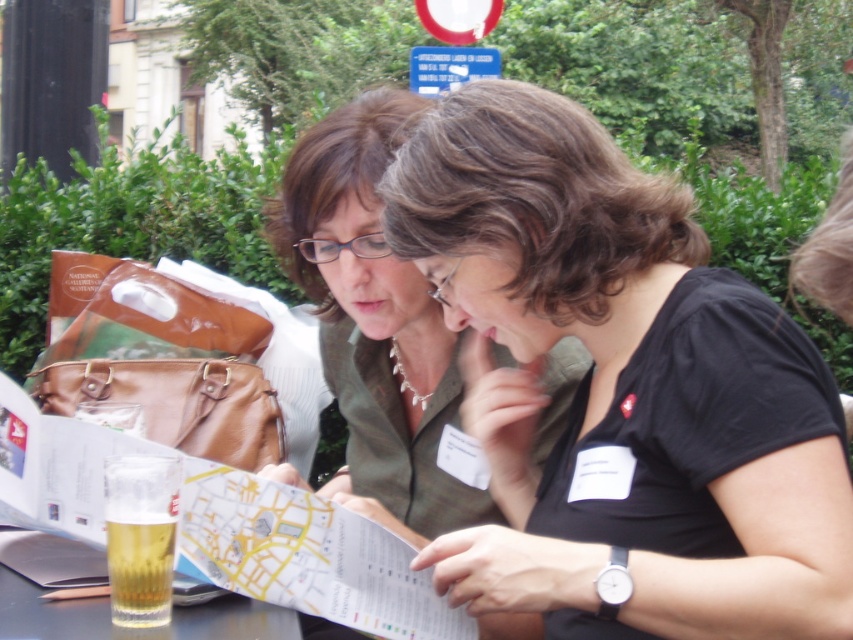
Describe the element at coordinates (619, 388) in the screenshot. The image size is (853, 640). I see `black matte shirt at center` at that location.

Who is more forward, (x=483, y=428) or (x=306, y=250)?

Point (x=483, y=428)

The width and height of the screenshot is (853, 640). Find the location of `black matte shirt at center`. black matte shirt at center is located at coordinates (619, 388).

Identify the location of black matte shirt at center. The height and width of the screenshot is (640, 853). (619, 388).

Can you confirm if translucent glass at lower left is wider than translucent glass beer at lower left?

Yes.

Which is in front, point (44, 634) or point (155, 572)?

Positioned in front is point (155, 572).

Is point (276, 632) behind point (160, 564)?

That is True.

At what (x,y) coordinates should I click in order to perform the action: click on translucent glass at lower left. Please return your answer as a coordinate pair (x, y). This screenshot has width=853, height=640. Looking at the image, I should click on (132, 628).

Is the position of green matte shirt at center more distant than that of translucent glass at lower left?

Yes, it is behind translucent glass at lower left.

You are a GUI agent. You are given a task and a screenshot of the screen. Output one action in this format:
    pyautogui.click(x=<x>, y=<y>)
    Task: Click on the green matte shirt at center
    Image resolution: width=853 pixels, height=640 pixels.
    Given the screenshot: What is the action you would take?
    pyautogui.click(x=374, y=321)